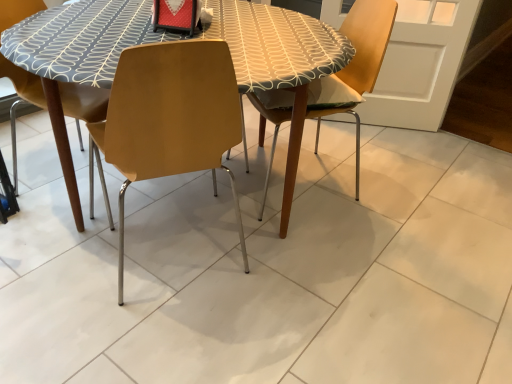
Locate an element on the screen. The width and height of the screenshot is (512, 384). vacant space to the left of matte wood chair at center, acting as the 1th chair starting from the left is located at coordinates (67, 240).